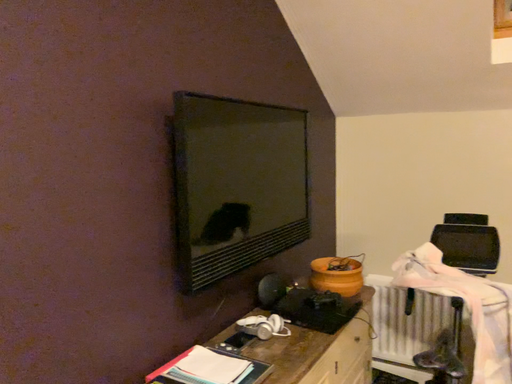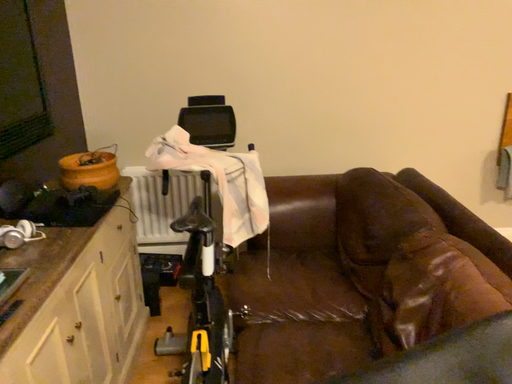
Question: How did the camera likely rotate when shooting the video?

Choices:
 (A) rotated downward
 (B) rotated upward

Answer: (A)